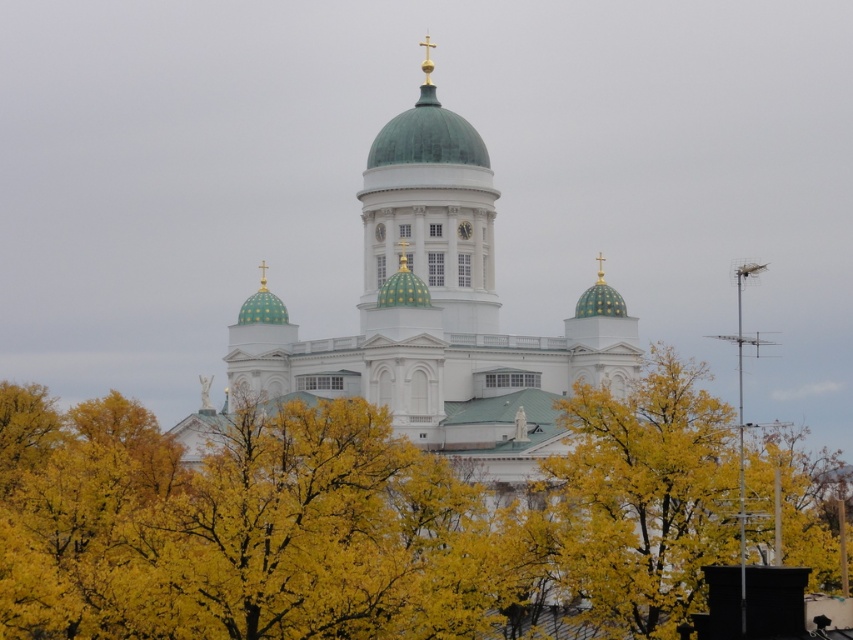
Question: Which object is positioned closest to the green matte dome at center?

Choices:
 (A) yellow leafy tree at center
 (B) green dome at center

Answer: (B)

Question: Considering the real-world distances, which object is closest to the green dome at center?

Choices:
 (A) yellow leafy tree at center
 (B) green matte dome at center

Answer: (B)

Question: Is yellow leafy tree at center positioned in front of green matte dome at center?

Choices:
 (A) no
 (B) yes

Answer: (B)

Question: From the image, what is the correct spatial relationship of yellow leafy tree at center in relation to green dome at center?

Choices:
 (A) above
 (B) below

Answer: (B)

Question: Which of the following is the farthest from the observer?

Choices:
 (A) (227, 506)
 (B) (434, 102)
 (C) (445, 192)

Answer: (B)

Question: Can you confirm if yellow leafy tree at center is wider than green matte dome at center?

Choices:
 (A) yes
 (B) no

Answer: (A)